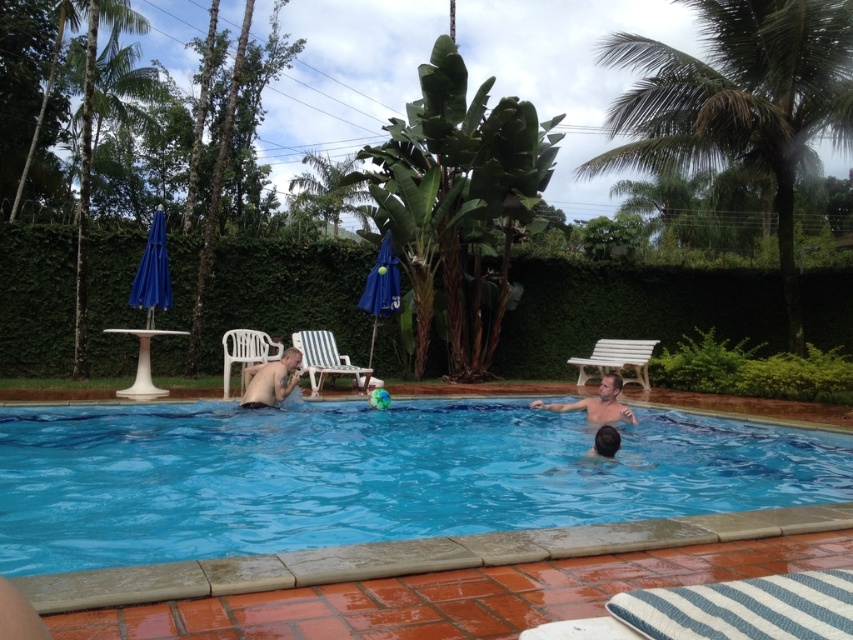
You are a guest at a resort and want to sit on the white plastic bench at center. However, you notice someone is currently sitting on the shiny skin at lower center. Can you sit on the bench without stepping over or around the person?

The white plastic bench at center is located below shiny skin at lower center, so you can sit on the bench without needing to step over or around the person since it is positioned lower and directly beneath them.

You are standing at the center of the pool and want to reach the white plastic chair at left. Which direction should you swim to get there?

You should swim to the left to reach the white plastic chair at left since it is located at point 0.552 on the x axis, which is to the left from the center of the pool.

You are planning to sit on the white plastic chair at left while the smooth skin man at center is standing next to you. Considering the chair and the man, which one has a smaller width?

The white plastic chair at left has a smaller width than the smooth skin man at center according to the description.